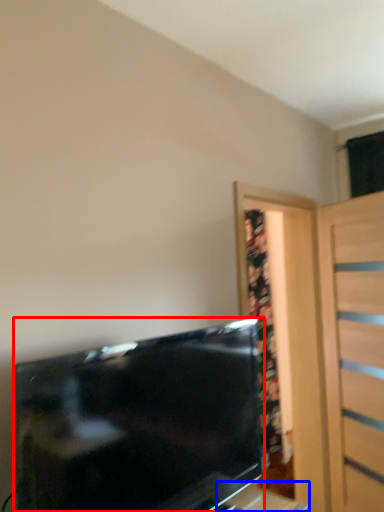
Question: Which point is closer to the camera, television (highlighted by a red box) or table (highlighted by a blue box)?

Choices:
 (A) television
 (B) table

Answer: (A)